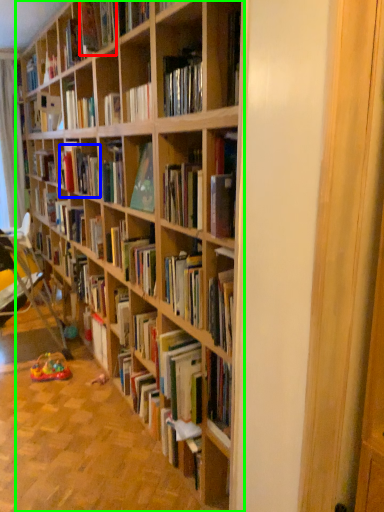
Question: Estimate the real-world distances between objects in this image. Which object is farther from book (highlighted by a red box), book (highlighted by a blue box) or bookcase (highlighted by a green box)?

Choices:
 (A) book
 (B) bookcase

Answer: (B)